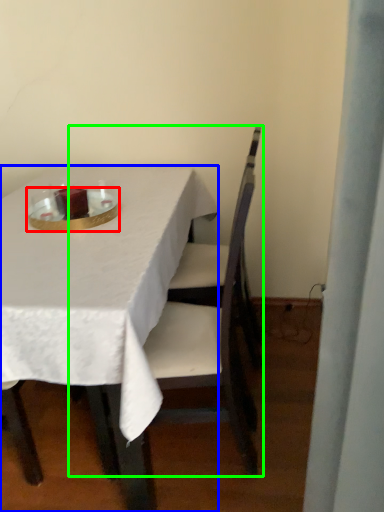
Question: Based on their relative distances, which object is farther from tableware (highlighted by a red box)? Choose from table (highlighted by a blue box) and chair (highlighted by a green box).

Choices:
 (A) table
 (B) chair

Answer: (B)